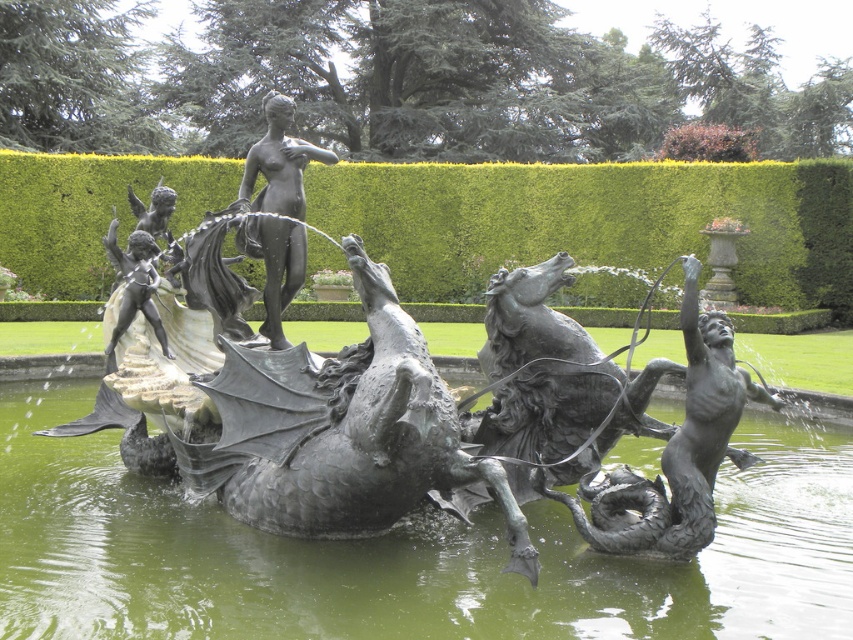
Is green metallic water at center wider than polished bronze man at center?

Correct, the width of green metallic water at center exceeds that of polished bronze man at center.

Is green metallic water at center taller than polished bronze man at center?

No, green metallic water at center is not taller than polished bronze man at center.

At what (x,y) coordinates should I click in order to perform the action: click on green metallic water at center. Please return your answer as a coordinate pair (x, y). Looking at the image, I should click on 404,554.

Who is more forward, [634,493] or [254,145]?

Point [634,493] is in front.

Is point (692, 353) less distant than point (265, 157)?

That is True.

Find the location of a particular element. This screenshot has height=640, width=853. polished bronze man at center is located at coordinates (676, 451).

Between point (759, 564) and point (303, 268), which one is positioned behind?

The point (303, 268) is behind.

Is green metallic water at center to the left of bronze statue at center from the viewer's perspective?

Incorrect, green metallic water at center is not on the left side of bronze statue at center.

Describe the element at coordinates (404, 554) in the screenshot. Image resolution: width=853 pixels, height=640 pixels. I see `green metallic water at center` at that location.

Locate an element on the screen. green metallic water at center is located at coordinates (404, 554).